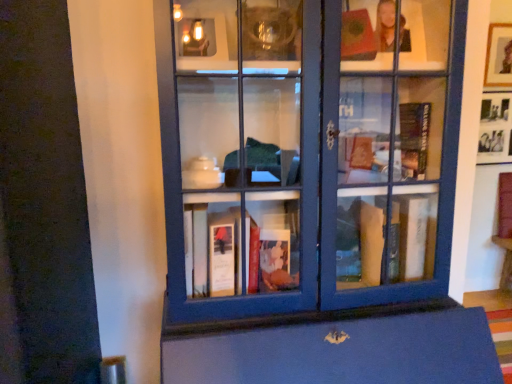
Question: Is black matte picture frame at upper right, arranged as the first picture frame when ordered from the bottom, positioned before matte blue bookcase at center?

Choices:
 (A) no
 (B) yes

Answer: (A)

Question: Does black matte picture frame at upper right, placed as the 2th picture frame when sorted from top to bottom, have a smaller size compared to matte blue bookcase at center?

Choices:
 (A) yes
 (B) no

Answer: (A)

Question: From a real-world perspective, is black matte picture frame at upper right, arranged as the first picture frame when ordered from the bottom, located beneath matte blue bookcase at center?

Choices:
 (A) no
 (B) yes

Answer: (A)

Question: Does black matte picture frame at upper right, placed as the 2th picture frame when sorted from top to bottom, have a lesser height compared to matte blue bookcase at center?

Choices:
 (A) no
 (B) yes

Answer: (B)

Question: Is black matte picture frame at upper right, placed as the 2th picture frame when sorted from top to bottom, taller than matte blue bookcase at center?

Choices:
 (A) yes
 (B) no

Answer: (B)

Question: Is point (312, 28) positioned closer to the camera than point (487, 114)?

Choices:
 (A) farther
 (B) closer

Answer: (B)

Question: Looking at the image, does matte blue bookcase at center seem bigger or smaller compared to black matte picture frame at upper right, placed as the 2th picture frame when sorted from top to bottom?

Choices:
 (A) small
 (B) big

Answer: (B)

Question: Is matte blue bookcase at center inside or outside of black matte picture frame at upper right, arranged as the first picture frame when ordered from the bottom?

Choices:
 (A) outside
 (B) inside

Answer: (A)

Question: Would you say matte blue bookcase at center is to the left or to the right of black matte picture frame at upper right, arranged as the first picture frame when ordered from the bottom, in the picture?

Choices:
 (A) right
 (B) left

Answer: (B)

Question: Looking at the image, does black matte picture frame at upper right, placed as the 2th picture frame when sorted from top to bottom, seem bigger or smaller compared to matte blue bookcase at center?

Choices:
 (A) big
 (B) small

Answer: (B)

Question: From the image's perspective, is black matte picture frame at upper right, placed as the 2th picture frame when sorted from top to bottom, above or below matte blue bookcase at center?

Choices:
 (A) below
 (B) above

Answer: (B)

Question: Choose the correct answer: Is black matte picture frame at upper right, placed as the 2th picture frame when sorted from top to bottom, inside matte blue bookcase at center or outside it?

Choices:
 (A) outside
 (B) inside

Answer: (A)

Question: Is point (510, 104) closer or farther from the camera than point (306, 183)?

Choices:
 (A) closer
 (B) farther

Answer: (B)

Question: Based on their positions, is matte blue bookcase at center located to the left or right of wooden picture frame at upper right, which is counted as the second picture frame, starting from the bottom?

Choices:
 (A) left
 (B) right

Answer: (A)

Question: From the image's perspective, is matte blue bookcase at center positioned above or below wooden picture frame at upper right, which is counted as the second picture frame, starting from the bottom?

Choices:
 (A) above
 (B) below

Answer: (B)